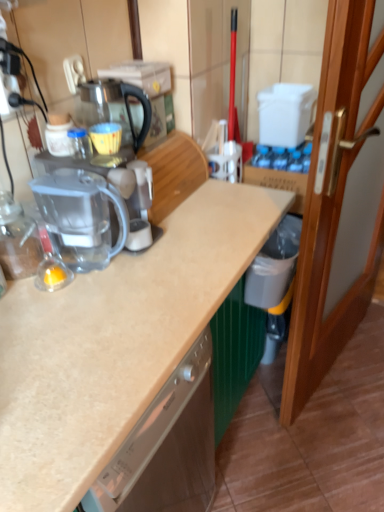
The image size is (384, 512). What do you see at coordinates (117, 99) in the screenshot? I see `transparent glass coffeepot at center` at bounding box center [117, 99].

What do you see at coordinates (339, 202) in the screenshot? I see `wooden door at right` at bounding box center [339, 202].

Describe the element at coordinates (82, 218) in the screenshot. I see `transparent plastic blender at left` at that location.

Locate an element on the screen. white plastic electric outlet at upper left is located at coordinates (74, 72).

Is wooden door at right positioned beyond the bounds of transparent plastic coffee machine at center?

Yes.

From a real-world perspective, between wooden door at right and transparent plastic coffee machine at center, who is vertically lower?

From a 3D spatial view, wooden door at right is below.

From the image's perspective, between wooden door at right and transparent plastic coffee machine at center, which one is located above?

transparent plastic coffee machine at center.

Which of these two, wooden door at right or transparent plastic coffee machine at center, is bigger?

Bigger between the two is wooden door at right.

Between transparent glass coffeepot at center and transparent plastic coffee machine at center, which one appears on the left side from the viewer's perspective?

transparent plastic coffee machine at center.

Is point (111, 81) farther from camera compared to point (82, 241)?

That is True.

The width and height of the screenshot is (384, 512). In order to click on coffee machine below the transparent glass coffeepot at center (from a real-world perspective) in this screenshot , I will do `click(95, 198)`.

Considering the sizes of objects transparent glass coffeepot at center and transparent plastic coffee machine at center in the image provided, who is thinner, transparent glass coffeepot at center or transparent plastic coffee machine at center?

With smaller width is transparent glass coffeepot at center.

From a real-world perspective, is transparent glass coffeepot at center physically below transparent plastic blender at left?

No.

Is transparent glass coffeepot at center situated inside transparent plastic blender at left or outside?

transparent glass coffeepot at center is spatially situated outside transparent plastic blender at left.

In the scene shown: Between transparent glass coffeepot at center and transparent plastic blender at left, which one has larger width?

transparent plastic blender at left is wider.

Who is taller, transparent plastic coffee machine at center or transparent plastic blender at left?

With more height is transparent plastic blender at left.

How different are the orientations of transparent plastic coffee machine at center and transparent plastic blender at left in degrees?

The facing directions of transparent plastic coffee machine at center and transparent plastic blender at left are 2.36 degrees apart.

Between transparent plastic coffee machine at center and transparent plastic blender at left, which one has smaller size?

transparent plastic blender at left is smaller.

How much distance is there between transparent plastic coffee machine at center and transparent plastic blender at left?

transparent plastic coffee machine at center is 3.36 centimeters away from transparent plastic blender at left.

From a real-world perspective, which object rests below the other?

From a 3D spatial view, transparent plastic blender at left is below.

Looking at this image, is white plastic electric outlet at upper left next to transparent plastic blender at left?

No, white plastic electric outlet at upper left is not next to transparent plastic blender at left.

What are the coordinates of `electric outlet above the transparent plastic blender at left (from the image's perspective)` in the screenshot? It's located at (74, 72).

Does white plastic electric outlet at upper left turn towards transparent plastic blender at left?

No, white plastic electric outlet at upper left does not turn towards transparent plastic blender at left.

From the image's perspective, relative to wooden door at right, is transparent plastic blender at left above or below?

From the image's perspective, transparent plastic blender at left appears below wooden door at right.

Is transparent plastic blender at left smaller than wooden door at right?

Correct, transparent plastic blender at left occupies less space than wooden door at right.

Does transparent plastic blender at left have a lesser width compared to wooden door at right?

No, transparent plastic blender at left is not thinner than wooden door at right.

Can you see transparent plastic blender at left touching wooden door at right?

There is a gap between transparent plastic blender at left and wooden door at right.

Is white plastic electric outlet at upper left not inside wooden door at right?

Yes, white plastic electric outlet at upper left is located beyond the bounds of wooden door at right.

Between white plastic electric outlet at upper left and wooden door at right, which one appears on the left side from the viewer's perspective?

white plastic electric outlet at upper left is more to the left.

Is white plastic electric outlet at upper left shorter than wooden door at right?

Correct, white plastic electric outlet at upper left is not as tall as wooden door at right.

This screenshot has width=384, height=512. Identify the location of door on the right side of transparent plastic coffee machine at center. pyautogui.click(x=339, y=202).

Find the location of `coffeepot lying behind the transparent plastic coffee machine at center`. coffeepot lying behind the transparent plastic coffee machine at center is located at coordinates (117, 99).

Considering their positions, is transparent plastic coffee machine at center positioned closer to wooden door at right than transparent glass coffeepot at center?

transparent plastic coffee machine at center is positioned closer to the anchor wooden door at right.

Looking at the image, which one is located further to white plastic electric outlet at upper left, wooden door at right or transparent plastic blender at left?

The object further to white plastic electric outlet at upper left is wooden door at right.

Estimate the real-world distances between objects in this image. Which object is closer to wooden door at right, transparent glass coffeepot at center or white plastic electric outlet at upper left?

transparent glass coffeepot at center.

Looking at the image, which one is located closer to transparent plastic coffee machine at center, transparent glass coffeepot at center or white plastic electric outlet at upper left?

transparent glass coffeepot at center.

Looking at the image, which one is located further to transparent plastic coffee machine at center, transparent glass coffeepot at center or transparent plastic blender at left?

transparent glass coffeepot at center.

When comparing their distances from transparent plastic coffee machine at center, does transparent glass coffeepot at center or wooden door at right seem closer?

Based on the image, transparent glass coffeepot at center appears to be nearer to transparent plastic coffee machine at center.

From the image, which object appears to be farther from transparent glass coffeepot at center, wooden door at right or transparent plastic coffee machine at center?

wooden door at right is positioned further to the anchor transparent glass coffeepot at center.

When comparing their distances from wooden door at right, does transparent glass coffeepot at center or transparent plastic coffee machine at center seem closer?

Among the two, transparent plastic coffee machine at center is located nearer to wooden door at right.

Image resolution: width=384 pixels, height=512 pixels. In order to click on coffee machine between transparent glass coffeepot at center and transparent plastic blender at left in the vertical direction in this screenshot , I will do `click(95, 198)`.

Find the location of a particular element. Image resolution: width=384 pixels, height=512 pixels. coffeepot between transparent plastic coffee machine at center and wooden door at right is located at coordinates (117, 99).

This screenshot has width=384, height=512. In order to click on coffeepot situated between transparent plastic blender at left and wooden door at right from left to right in this screenshot , I will do `click(117, 99)`.

Where is `coffeepot between white plastic electric outlet at upper left and transparent plastic blender at left in the up-down direction`? This screenshot has height=512, width=384. coffeepot between white plastic electric outlet at upper left and transparent plastic blender at left in the up-down direction is located at coordinates (117, 99).